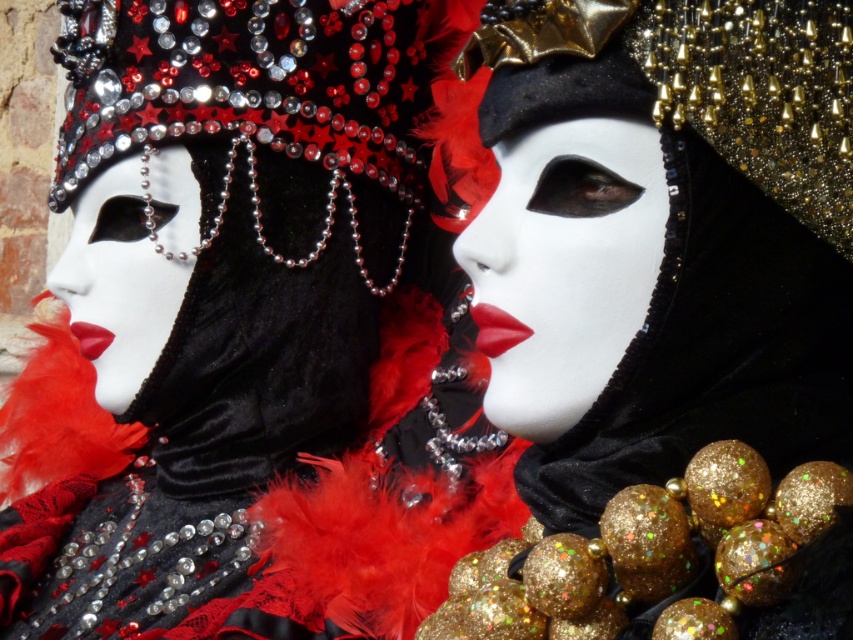
In the scene shown: You are a costume designer preparing for a Venetian carnival. You have two masks in front of you, the velvet mask at center and the matte black mask at center. Which mask would you choose if you want a more prominent feature for the costume ensemble?

The velvet mask at center has a larger size compared to the matte black mask at center, so choosing the velvet mask at center would provide a more prominent feature for the costume ensemble.

You are a costume designer preparing for a play and need to choose between two masks. The velvet mask at center and the matte black mask at center are both options. Based on their physical characteristics, which mask would you recommend if you want one that stands out more visually due to its size?

The velvet mask at center has a greater height compared to the matte black mask at center, so it would stand out more visually due to its larger size.

You are standing in front of the two carnival costumed individuals. There is a point at coordinates point (184, 220) that you need to reach. Can you estimate how far you need to walk to reach that point?

The point at coordinates point (184, 220) is 1.81 meters away from your current position, so you need to walk approximately 1.81 meters to reach it.